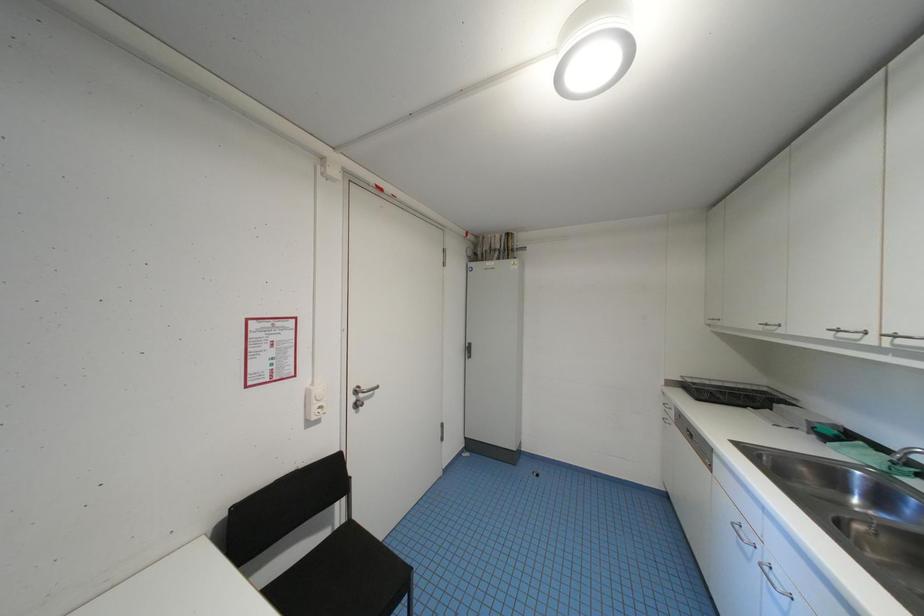
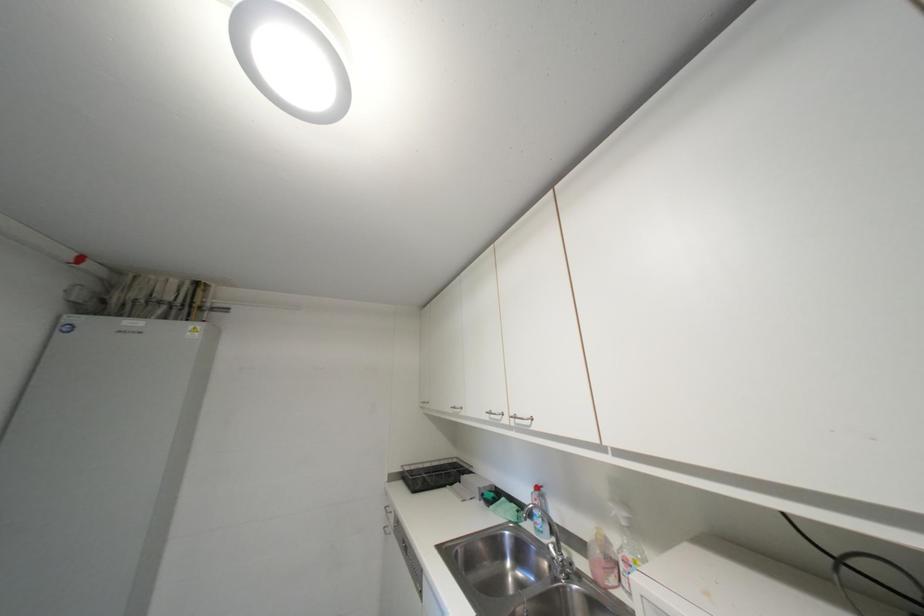
The first image is from the beginning of the video and the second image is from the end. How did the camera likely rotate when shooting the video?

The camera's rotation is toward right-up.